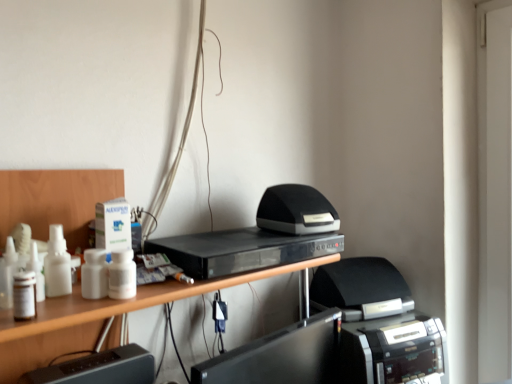
Question: Is black glossy monitor at lower center, the first register from the right, located outside black plastic printer at lower right, the second printer viewed from the top?

Choices:
 (A) no
 (B) yes

Answer: (B)

Question: Is black glossy monitor at lower center, the first register from the right, bigger than black plastic printer at lower right, which is the 1th printer in bottom-to-top order?

Choices:
 (A) no
 (B) yes

Answer: (A)

Question: Could you tell me if black glossy monitor at lower center, the first register from the right, is facing black plastic printer at lower right, the second printer viewed from the top?

Choices:
 (A) no
 (B) yes

Answer: (A)

Question: Considering the relative sizes of black glossy monitor at lower center, arranged as the 2th register when viewed from the left, and black plastic printer at lower right, the second printer viewed from the top, in the image provided, is black glossy monitor at lower center, arranged as the 2th register when viewed from the left, thinner than black plastic printer at lower right, the second printer viewed from the top,?

Choices:
 (A) yes
 (B) no

Answer: (A)

Question: From a real-world perspective, is black glossy monitor at lower center, the first register from the right, beneath black plastic printer at lower right, which is the 1th printer in bottom-to-top order?

Choices:
 (A) yes
 (B) no

Answer: (B)

Question: Is black glossy monitor at lower center, arranged as the 2th register when viewed from the left, taller than black plastic printer at lower right, the second printer viewed from the top?

Choices:
 (A) no
 (B) yes

Answer: (A)

Question: Can you confirm if black matte speaker at center, which ranks as the second printer in bottom-to-top order, is shorter than black plastic printer at lower right, the second printer viewed from the top?

Choices:
 (A) no
 (B) yes

Answer: (B)

Question: Can you confirm if black matte speaker at center, which ranks as the second printer in bottom-to-top order, is wider than black plastic printer at lower right, the second printer viewed from the top?

Choices:
 (A) no
 (B) yes

Answer: (A)

Question: Would you say black plastic printer at lower right, which is the 1th printer in bottom-to-top order, is part of black matte speaker at center, the first printer positioned from the top,'s contents?

Choices:
 (A) yes
 (B) no

Answer: (B)

Question: From the image's perspective, is black matte speaker at center, which ranks as the second printer in bottom-to-top order, on top of black plastic printer at lower right, the second printer viewed from the top?

Choices:
 (A) yes
 (B) no

Answer: (A)

Question: Can you confirm if black matte speaker at center, which ranks as the second printer in bottom-to-top order, is thinner than black plastic printer at lower right, the second printer viewed from the top?

Choices:
 (A) yes
 (B) no

Answer: (A)

Question: Is black matte speaker at center, the first printer positioned from the top, positioned in front of black plastic printer at lower right, which is the 1th printer in bottom-to-top order?

Choices:
 (A) yes
 (B) no

Answer: (A)

Question: Can you confirm if black glossy monitor at lower center, arranged as the 2th register when viewed from the left, is positioned to the right of black plastic dvd player at center?

Choices:
 (A) yes
 (B) no

Answer: (A)